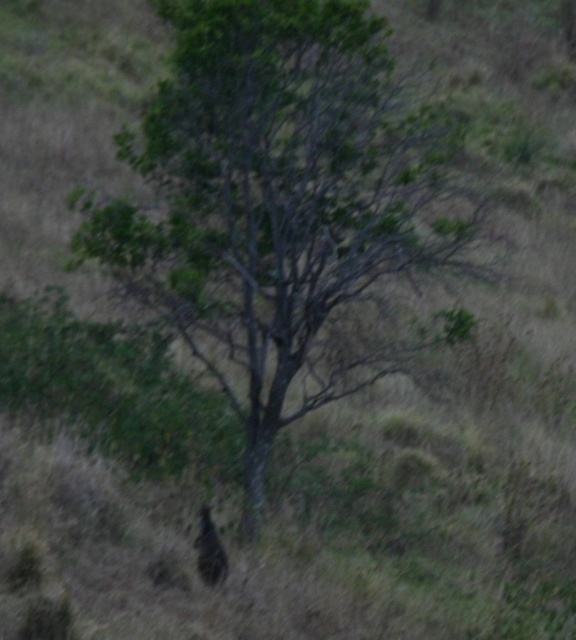
Question: Is green leafy tree at center bigger than brown furry animal at lower center?

Choices:
 (A) yes
 (B) no

Answer: (B)

Question: Does green leafy tree at center appear over brown furry animal at lower center?

Choices:
 (A) yes
 (B) no

Answer: (A)

Question: Is green leafy tree at center behind brown furry animal at lower center?

Choices:
 (A) no
 (B) yes

Answer: (B)

Question: Which point is closer to the camera?

Choices:
 (A) (206, 552)
 (B) (289, 232)

Answer: (A)

Question: Which point is closer to the camera?

Choices:
 (A) (223, 573)
 (B) (244, 289)

Answer: (A)